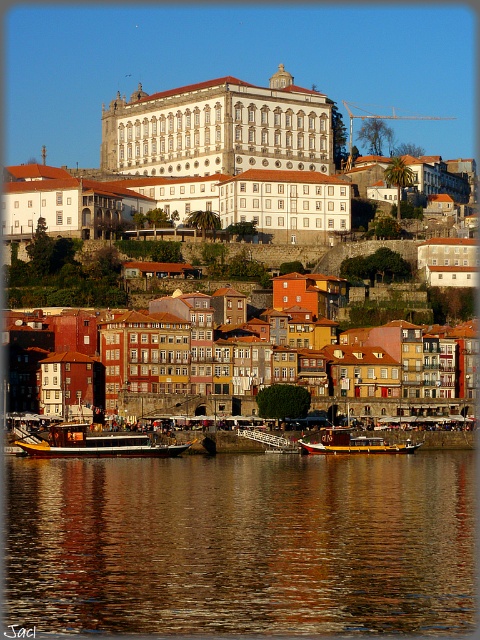
Does brown reflective water at center appear on the right side of wooden polished boat at center?

In fact, brown reflective water at center is to the left of wooden polished boat at center.

Which is more to the right, brown reflective water at center or wooden polished boat at center?

wooden polished boat at center

From the picture: Who is more distant from viewer, (92, 582) or (321, 449)?

The point (321, 449) is behind.

What are the coordinates of `brown reflective water at center` in the screenshot? It's located at (242, 545).

Which is below, brown reflective water at center or white stone building at center?

brown reflective water at center is below.

Does brown reflective water at center appear under white stone building at center?

Correct, brown reflective water at center is located below white stone building at center.

Where is `brown reflective water at center`? brown reflective water at center is located at coordinates (242, 545).

Is brown reflective water at center bigger than yellow polished wood boat at lower left?

Yes.

Who is positioned more to the left, brown reflective water at center or yellow polished wood boat at lower left?

Positioned to the left is yellow polished wood boat at lower left.

Which is behind, point (422, 508) or point (123, 436)?

Point (123, 436)

Identify the location of brown reflective water at center. The height and width of the screenshot is (640, 480). (242, 545).